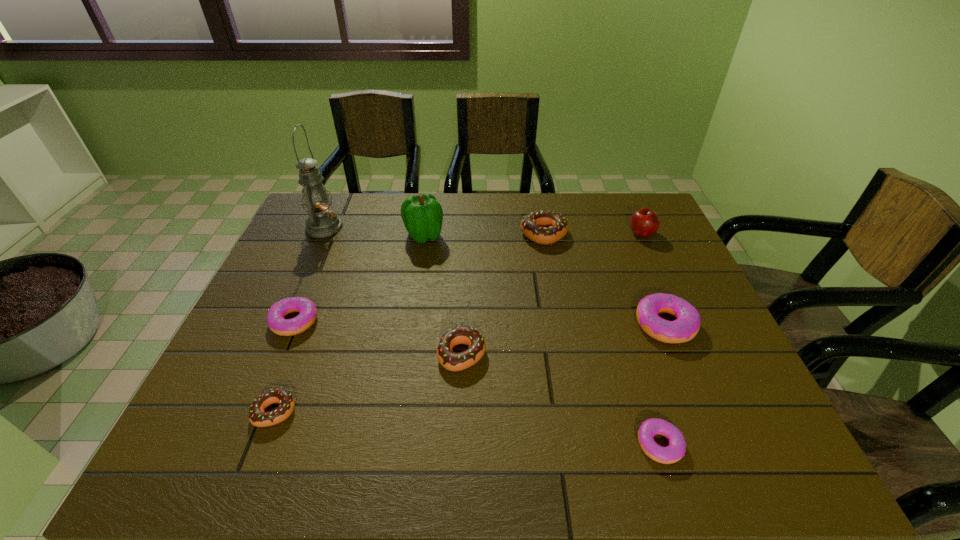
Locate an element on the screen. The height and width of the screenshot is (540, 960). vacant region between the shortest object and the rightmost brown doughnut is located at coordinates (602, 340).

Find the location of a particular element. vacant area that lies between the second smallest pink doughnut and the leftmost brown doughnut is located at coordinates (285, 366).

The height and width of the screenshot is (540, 960). In order to click on free point between the biggest pink doughnut and the shortest doughnut in this screenshot , I will do `click(662, 384)`.

In order to click on vacant area between the leftmost brown doughnut and the second farthest brown doughnut in this screenshot , I will do click(369, 383).

Image resolution: width=960 pixels, height=540 pixels. I want to click on free space between the leftmost brown doughnut and the shortest object, so click(x=468, y=428).

At what (x,y) coordinates should I click in order to perform the action: click on free spot between the second brown doughnut from left to right and the leftmost pink doughnut. Please return your answer as a coordinate pair (x, y). This screenshot has height=540, width=960. Looking at the image, I should click on (378, 338).

What are the coordinates of `free space that is in between the leftmost pink doughnut and the nearest pink doughnut` in the screenshot? It's located at (477, 383).

Image resolution: width=960 pixels, height=540 pixels. In order to click on vacant space in between the nearest brown doughnut and the second biggest brown doughnut in this screenshot , I will do `click(369, 383)`.

Identify the location of vacant area between the tallest object and the leftmost pink doughnut. (309, 274).

Identify which object is the closest to the biggest pink doughnut. Please provide its 2D coordinates. Your answer should be formatted as a tuple, i.e. [(x, y)], where the tuple contains the x and y coordinates of a point satisfying the conditions above.

[(675, 451)]